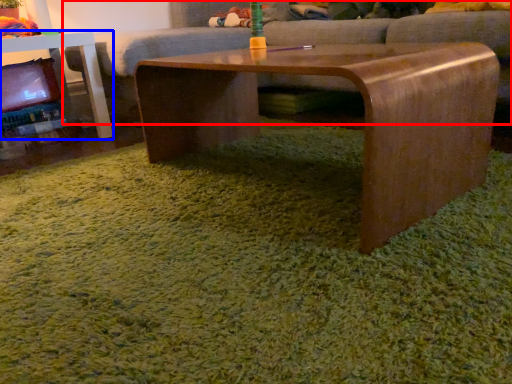
Question: Which point is closer to the camera, studio couch (highlighted by a red box) or table (highlighted by a blue box)?

Choices:
 (A) studio couch
 (B) table

Answer: (B)